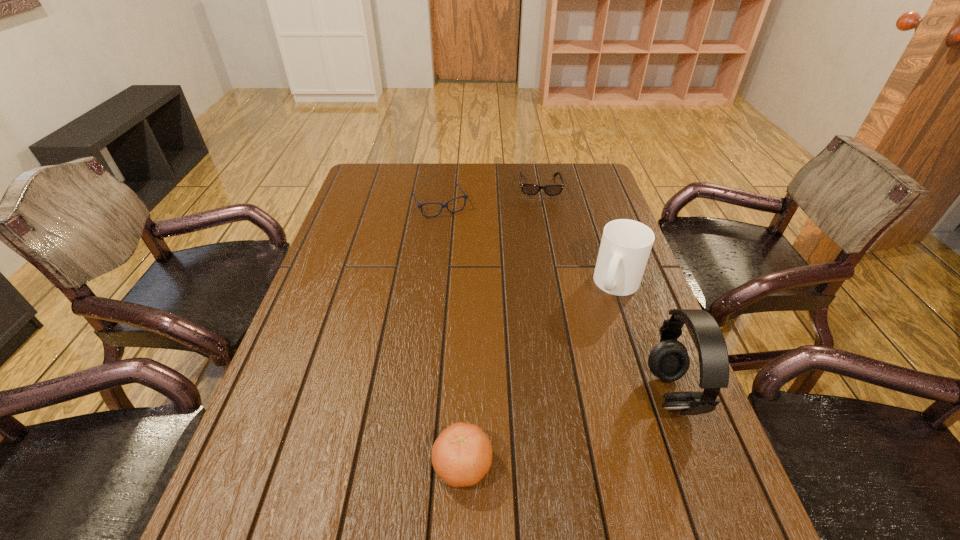
Locate an element on the screen. Image resolution: width=960 pixels, height=540 pixels. free area in between the second tallest object and the third object from right to left is located at coordinates (579, 235).

At what (x,y) coordinates should I click in order to perform the action: click on free space between the clementine and the third nearest object. Please return your answer as a coordinate pair (x, y). Looking at the image, I should click on pyautogui.click(x=540, y=375).

Where is `blank region between the third shortest object and the left spectacles`? blank region between the third shortest object and the left spectacles is located at coordinates (451, 335).

Identify the location of vacant area between the third shortest object and the earphone. The image size is (960, 540). (566, 430).

Identify which object is the fourth closest to the earphone. Please provide its 2D coordinates. Your answer should be formatted as a tuple, i.e. [(x, y)], where the tuple contains the x and y coordinates of a point satisfying the conditions above.

[(464, 196)]

The height and width of the screenshot is (540, 960). What are the coordinates of `object that is the fourth closest to the third object from left to right` in the screenshot? It's located at (462, 454).

What are the coordinates of `vacant space that satisfies the following two spatial constraints: 1. on the front side of the mug; 2. on the right side of the right spectacles` in the screenshot? It's located at (558, 284).

At what (x,y) coordinates should I click in order to perform the action: click on blank area in the image that satisfies the following two spatial constraints: 1. on the back side of the left spectacles; 2. on the left side of the third object from right to left. Please return your answer as a coordinate pair (x, y). The width and height of the screenshot is (960, 540). Looking at the image, I should click on (442, 187).

Where is `vacant space that satisfies the following two spatial constraints: 1. on the front side of the earphone; 2. on the ear cups of the left spectacles`? Image resolution: width=960 pixels, height=540 pixels. vacant space that satisfies the following two spatial constraints: 1. on the front side of the earphone; 2. on the ear cups of the left spectacles is located at coordinates (416, 396).